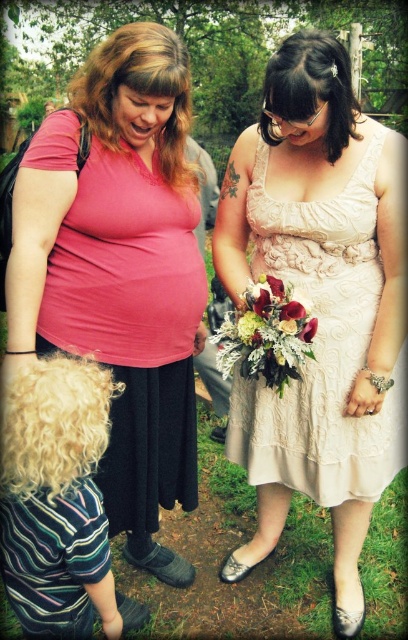
How distant is ivory lace dress at center from velvety red rose at center?

16.54 inches

Does ivory lace dress at center have a larger size compared to velvety red rose at center?

Yes.

Locate an element on the screen. The height and width of the screenshot is (640, 408). ivory lace dress at center is located at coordinates pos(321,342).

Can you confirm if pink matte shirt at upper left is bigger than velvety red rose at center?

Yes.

Between point (95, 323) and point (292, 308), which one is positioned in front?

Point (292, 308) is in front.

You are a GUI agent. You are given a task and a screenshot of the screen. Output one action in this format:
    pyautogui.click(x=<x>, y=<y>)
    Task: Click on the pink matte shirt at upper left
    
    Given the screenshot: What is the action you would take?
    pyautogui.click(x=121, y=272)

Can you confirm if ivory lace dress at center is shorter than white silk bouquet at center?

No.

Between ivory lace dress at center and white silk bouquet at center, which one has less height?

With less height is white silk bouquet at center.

Between point (297, 228) and point (310, 330), which one is positioned in front?

Point (310, 330) is in front.

The image size is (408, 640). Find the location of `ivory lace dress at center`. ivory lace dress at center is located at coordinates (321, 342).